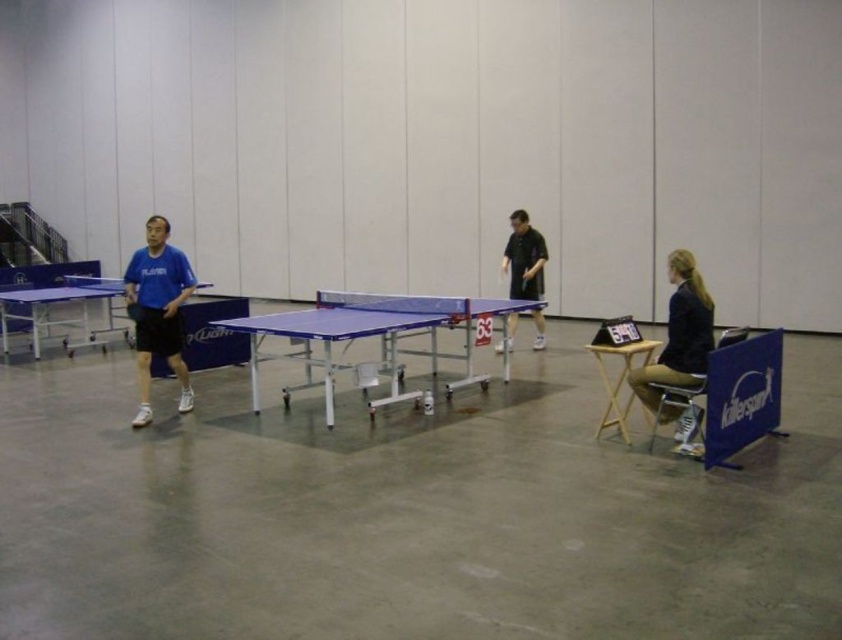
Does blue matte shirt at left have a larger size compared to metallic silver stool at lower right?

Yes, blue matte shirt at left is bigger than metallic silver stool at lower right.

Is blue matte shirt at left shorter than metallic silver stool at lower right?

No, blue matte shirt at left is not shorter than metallic silver stool at lower right.

Who is more distant from viewer, (144, 298) or (699, 451)?

Positioned behind is point (144, 298).

The width and height of the screenshot is (842, 640). In order to click on blue matte shirt at left in this screenshot , I will do `click(158, 310)`.

Who is shorter, light wood folding table at lower right or metallic silver stool at lower right?

metallic silver stool at lower right is shorter.

Between light wood folding table at lower right and metallic silver stool at lower right, which one has more height?

With more height is light wood folding table at lower right.

Is point (632, 403) positioned in front of point (675, 396)?

That is False.

Where is `light wood folding table at lower right`? This screenshot has width=842, height=640. light wood folding table at lower right is located at coordinates (619, 380).

Does blue matte shirt at left have a greater height compared to black matte shirt at center?

Yes.

Between blue matte shirt at left and black matte shirt at center, which one is positioned higher?

black matte shirt at center is above.

Is point (180, 278) behind point (536, 278)?

No.

This screenshot has width=842, height=640. Identify the location of blue matte shirt at left. (158, 310).